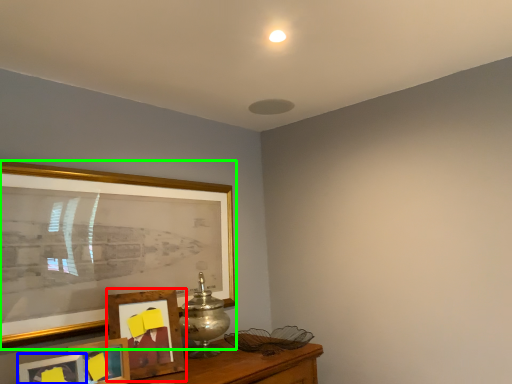
Question: Which is farther away from picture frame (highlighted by a red box)? picture frame (highlighted by a blue box) or picture frame (highlighted by a green box)?

Choices:
 (A) picture frame
 (B) picture frame

Answer: (B)